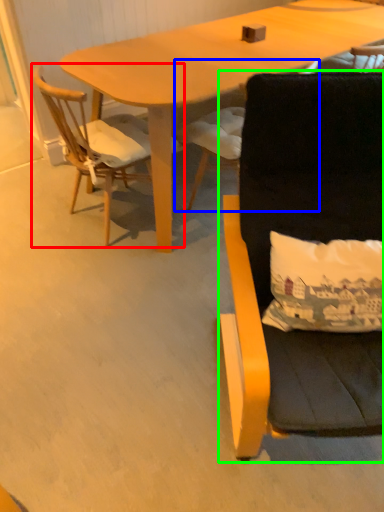
Question: Which object is positioned farthest from chair (highlighted by a red box)? Select from chair (highlighted by a blue box) and chair (highlighted by a green box).

Choices:
 (A) chair
 (B) chair

Answer: (B)